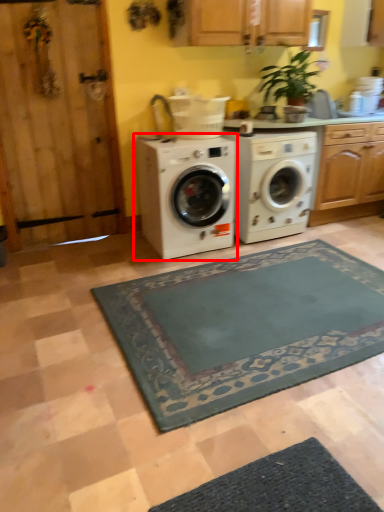
Question: Where is washing machine (annotated by the red box) located in relation to washing machine in the image?

Choices:
 (A) left
 (B) right

Answer: (A)